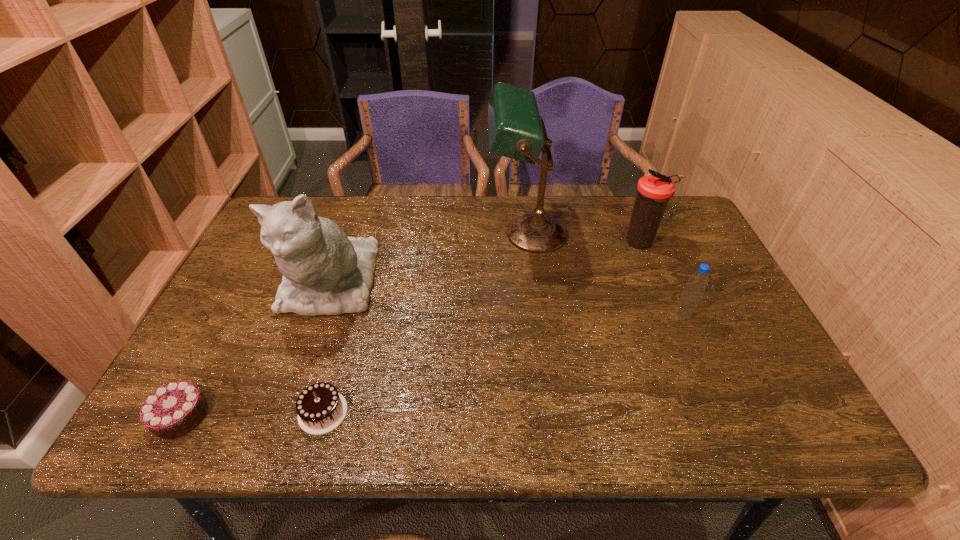
You are a GUI agent. You are given a task and a screenshot of the screen. Output one action in this format:
    pyautogui.click(x=<x>, y=<y>)
    Task: Click on the thermos bottle located in the right edge section of the desktop
    The width and height of the screenshot is (960, 540).
    Given the screenshot: What is the action you would take?
    pyautogui.click(x=653, y=191)

Locate an element on the screen. Image resolution: width=960 pixels, height=540 pixels. water bottle present at the right edge is located at coordinates (696, 284).

Where is `object at the far left corner`? This screenshot has height=540, width=960. object at the far left corner is located at coordinates (325, 272).

The image size is (960, 540). Find the location of `object that is at the near left corner`. object that is at the near left corner is located at coordinates (173, 410).

Image resolution: width=960 pixels, height=540 pixels. I want to click on object situated at the far right corner, so click(x=653, y=191).

Locate an element on the screen. Image resolution: width=960 pixels, height=540 pixels. free spot at the far edge of the desktop is located at coordinates (600, 228).

Where is `vacant region at the left edge of the desktop`? Image resolution: width=960 pixels, height=540 pixels. vacant region at the left edge of the desktop is located at coordinates (231, 311).

Where is `vacant region at the near left corner of the desktop`? The width and height of the screenshot is (960, 540). vacant region at the near left corner of the desktop is located at coordinates (222, 440).

You are a GUI agent. You are given a task and a screenshot of the screen. Output one action in this format:
    pyautogui.click(x=<x>, y=<y>)
    Task: Click on the vacant space at the far right corner
    The image size is (960, 540).
    Given the screenshot: What is the action you would take?
    pyautogui.click(x=662, y=230)

This screenshot has width=960, height=540. I want to click on vacant area between the thermos bottle and the leftmost object, so click(x=410, y=329).